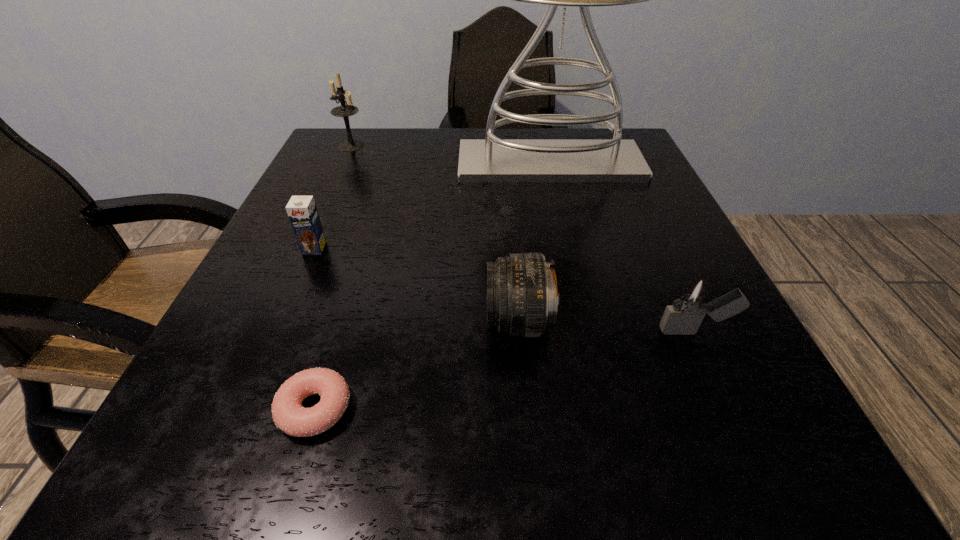
This screenshot has height=540, width=960. What are the coordinates of `the tallest object` in the screenshot? It's located at (491, 160).

In order to click on the fifth shortest object in this screenshot , I will do `click(345, 110)`.

You are a GUI agent. You are given a task and a screenshot of the screen. Output one action in this format:
    pyautogui.click(x=<x>, y=<y>)
    Task: Click on the telephoto lens
    The height and width of the screenshot is (540, 960).
    Given the screenshot: What is the action you would take?
    pyautogui.click(x=521, y=289)

You are a GUI agent. You are given a task and a screenshot of the screen. Output one action in this format:
    pyautogui.click(x=<x>, y=<y>)
    Task: Click on the igniter
    
    Given the screenshot: What is the action you would take?
    pos(690,303)

Locate an element on the screen. The height and width of the screenshot is (540, 960). the fourth nearest object is located at coordinates (302, 212).

Locate an element on the screen. The width and height of the screenshot is (960, 540). the nearest object is located at coordinates (288, 414).

You are a GUI agent. You are given a task and a screenshot of the screen. Output one action in this format:
    pyautogui.click(x=<x>, y=<y>)
    Task: Click on the doughnut
    
    Given the screenshot: What is the action you would take?
    pyautogui.click(x=288, y=414)

The width and height of the screenshot is (960, 540). What are the coordinates of `vacant region located on the left of the table lamp` in the screenshot? It's located at (383, 164).

Locate an element on the screen. The image size is (960, 540). vacant area situated on the right of the candle holder is located at coordinates (397, 146).

This screenshot has height=540, width=960. I want to click on free location located 0.330m at the front element of the telephoto lens, so click(260, 322).